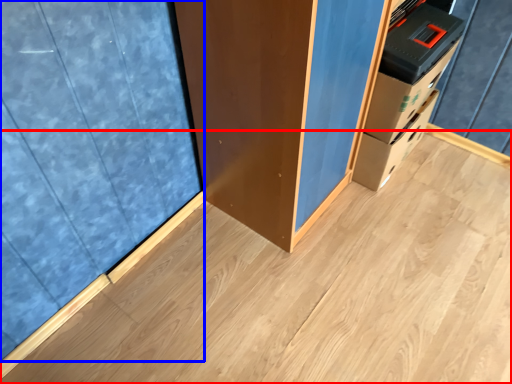
Question: Which object appears farthest to the camera in this image, plywood (highlighted by a red box) or curtain (highlighted by a blue box)?

Choices:
 (A) plywood
 (B) curtain

Answer: (A)